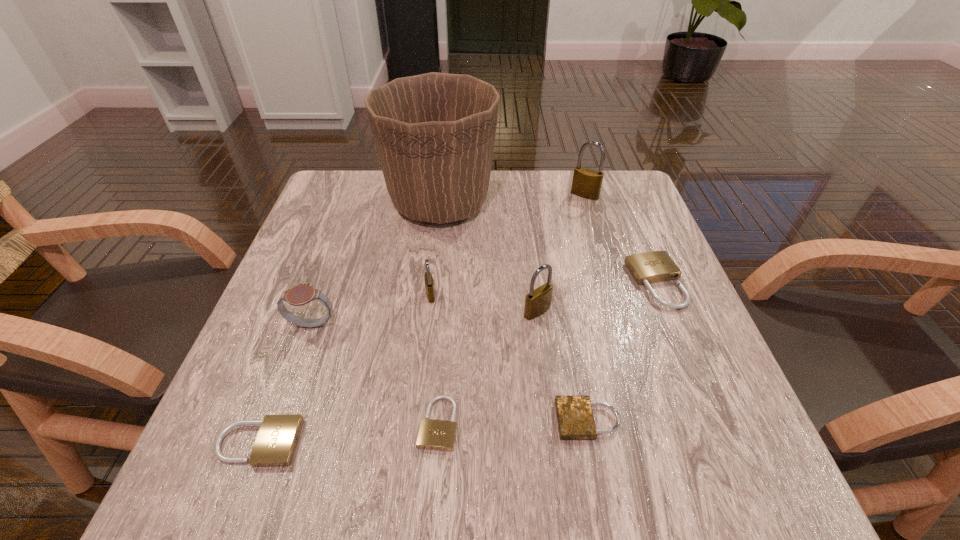
The height and width of the screenshot is (540, 960). Identify the location of vacant space that satisfies the following two spatial constraints: 1. on the back side of the eighth shortest object; 2. on the right side of the gray watch. click(358, 195).